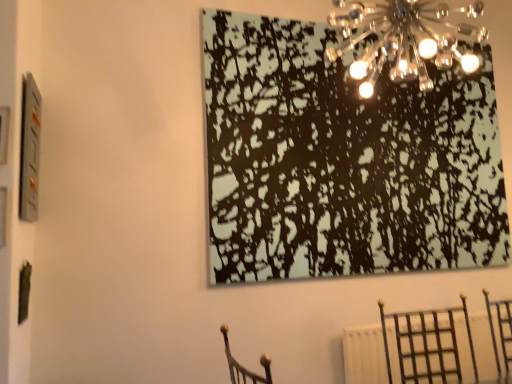
Question: From a real-world perspective, is metallic dark brown chair at lower right beneath metallic silver picture frame at upper left?

Choices:
 (A) no
 (B) yes

Answer: (B)

Question: Would you say metallic dark brown chair at lower right is a long distance from metallic silver picture frame at upper left?

Choices:
 (A) no
 (B) yes

Answer: (B)

Question: Does metallic dark brown chair at lower right have a greater width compared to metallic silver picture frame at upper left?

Choices:
 (A) yes
 (B) no

Answer: (A)

Question: Does metallic dark brown chair at lower right come in front of metallic silver picture frame at upper left?

Choices:
 (A) no
 (B) yes

Answer: (B)

Question: From the image's perspective, is metallic dark brown chair at lower right above metallic silver picture frame at upper left?

Choices:
 (A) yes
 (B) no

Answer: (B)

Question: Is metallic dark brown chair at lower right to the left of metallic silver picture frame at upper left from the viewer's perspective?

Choices:
 (A) yes
 (B) no

Answer: (B)

Question: From the image's perspective, is black textured painting at upper center above metallic dark brown chair at lower right?

Choices:
 (A) yes
 (B) no

Answer: (A)

Question: Is black textured painting at upper center aimed at metallic dark brown chair at lower right?

Choices:
 (A) no
 (B) yes

Answer: (A)

Question: Can you confirm if black textured painting at upper center is wider than metallic dark brown chair at lower right?

Choices:
 (A) yes
 (B) no

Answer: (B)

Question: Does black textured painting at upper center have a greater height compared to metallic dark brown chair at lower right?

Choices:
 (A) no
 (B) yes

Answer: (B)

Question: Can you confirm if black textured painting at upper center is thinner than metallic dark brown chair at lower right?

Choices:
 (A) yes
 (B) no

Answer: (A)

Question: Is black textured painting at upper center not near metallic dark brown chair at lower right?

Choices:
 (A) no
 (B) yes

Answer: (A)

Question: Does metallic glass chandelier at upper center have a lesser width compared to metallic silver picture frame at upper left?

Choices:
 (A) no
 (B) yes

Answer: (A)